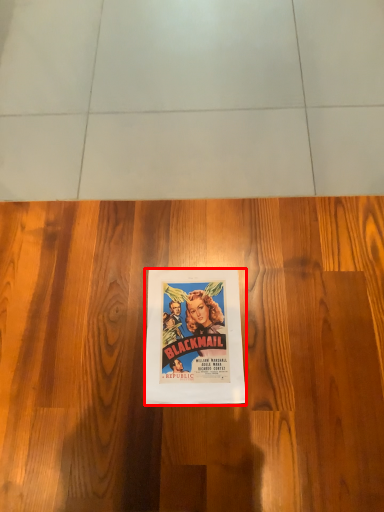
Question: Observing the image, what is the correct spatial positioning of poster (annotated by the red box) in reference to hardwood?

Choices:
 (A) left
 (B) right

Answer: (B)